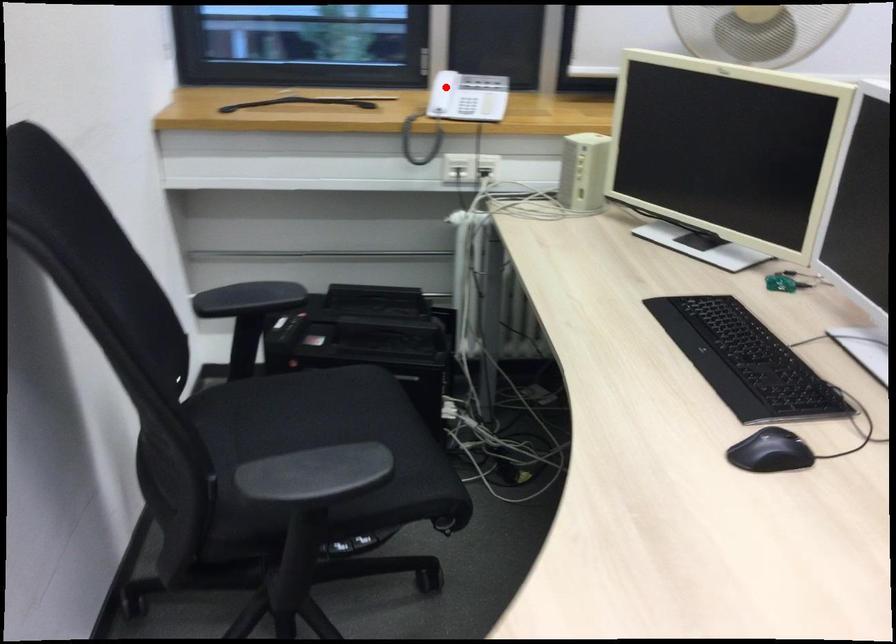
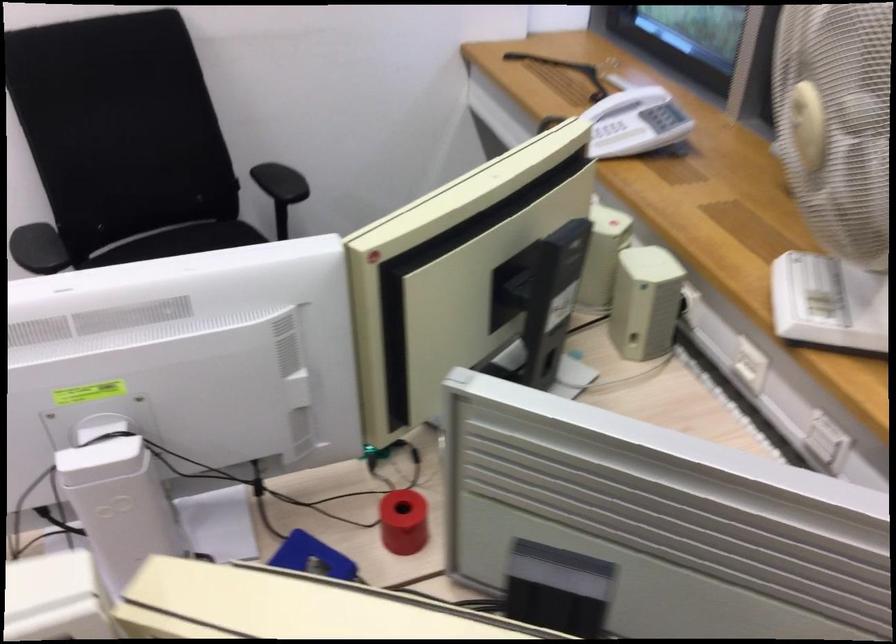
Question: I am providing you with two images of the same scene from different viewpoints. A red point is shown in image1. For the corresponding object point in image2, is it positioned nearer or farther from the camera?

Choices:
 (A) Nearer
 (B) Farther

Answer: (A)